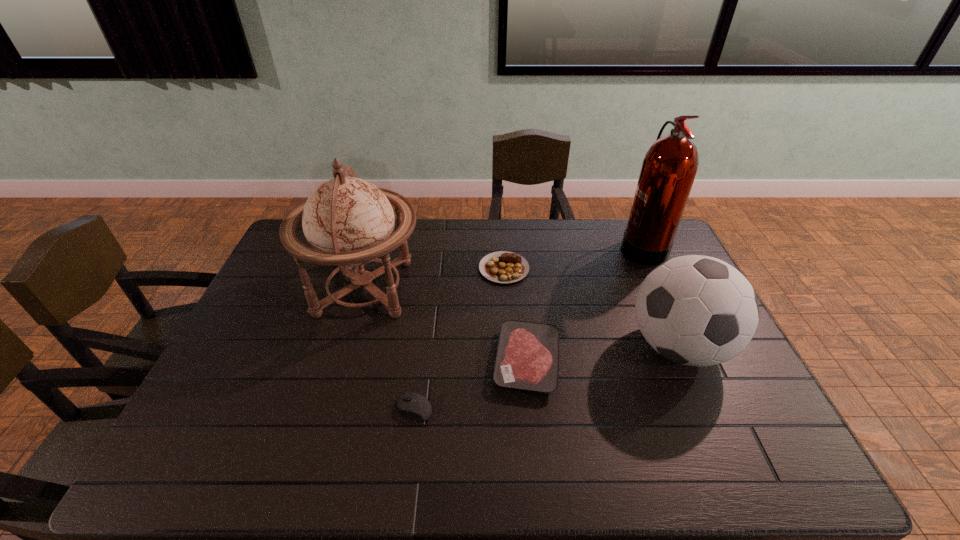
In order to click on vacant region that satisfies the following two spatial constraints: 1. on the back side of the soccer ball; 2. on the right side of the computer equipment in this screenshot , I will do `click(422, 347)`.

Identify the location of free space that satisfies the following two spatial constraints: 1. on the back side of the computer equipment; 2. at the front of the globe showing Africa. (430, 288).